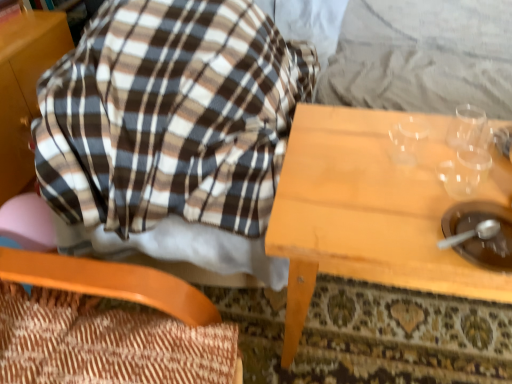
Question: Is brown matte bowl at lower right facing away from wooden textured chair at left?

Choices:
 (A) no
 (B) yes

Answer: (A)

Question: Does brown matte bowl at lower right have a greater width compared to wooden textured chair at left?

Choices:
 (A) no
 (B) yes

Answer: (A)

Question: Is brown matte bowl at lower right at the right side of wooden textured chair at left?

Choices:
 (A) yes
 (B) no

Answer: (A)

Question: From a real-world perspective, is brown matte bowl at lower right positioned under wooden textured chair at left based on gravity?

Choices:
 (A) no
 (B) yes

Answer: (A)

Question: Is wooden textured chair at left a part of brown matte bowl at lower right?

Choices:
 (A) no
 (B) yes

Answer: (A)

Question: From a real-world perspective, is brown matte bowl at lower right on wooden textured chair at left?

Choices:
 (A) no
 (B) yes

Answer: (B)

Question: From the image's perspective, is brown plaid blanket at upper left on wooden textured chair at left?

Choices:
 (A) yes
 (B) no

Answer: (A)

Question: From a real-world perspective, is brown plaid blanket at upper left positioned over wooden textured chair at left based on gravity?

Choices:
 (A) yes
 (B) no

Answer: (B)

Question: Is brown plaid blanket at upper left far from wooden textured chair at left?

Choices:
 (A) no
 (B) yes

Answer: (A)

Question: Does brown plaid blanket at upper left have a greater height compared to wooden textured chair at left?

Choices:
 (A) yes
 (B) no

Answer: (A)

Question: Is wooden textured chair at left at the back of brown plaid blanket at upper left?

Choices:
 (A) no
 (B) yes

Answer: (A)

Question: Does brown plaid blanket at upper left have a lesser width compared to wooden textured chair at left?

Choices:
 (A) no
 (B) yes

Answer: (A)

Question: Does wooden textured chair at left have a lesser width compared to brown matte bowl at lower right?

Choices:
 (A) yes
 (B) no

Answer: (B)